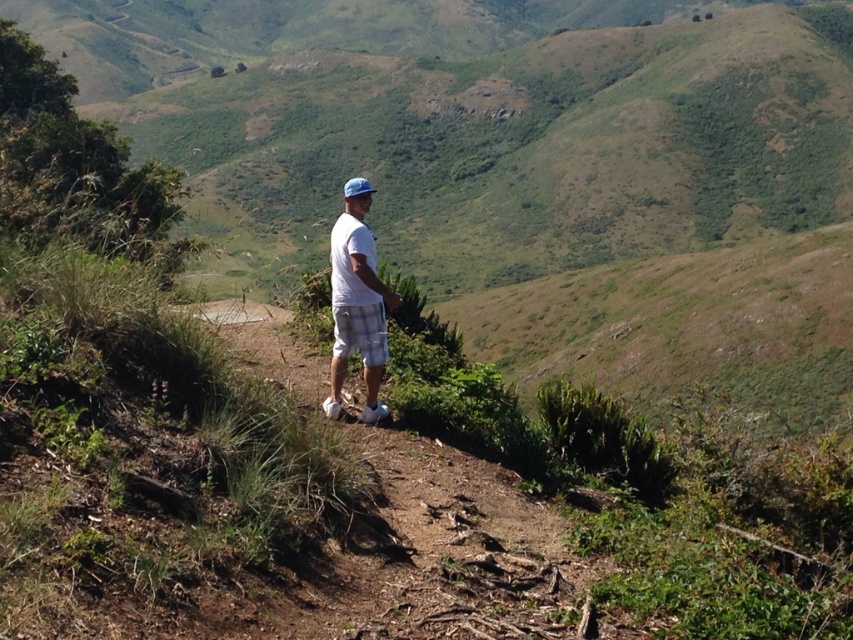
Question: Which of the following is the farthest from the observer?

Choices:
 (A) white cotton shirt at center
 (B) white checkered shorts at center

Answer: (B)

Question: Among these points, which one is farthest from the camera?

Choices:
 (A) (351, 186)
 (B) (364, 317)

Answer: (B)

Question: Is white cotton shirt at center bigger than white checkered shorts at center?

Choices:
 (A) no
 (B) yes

Answer: (B)

Question: Which point is farther to the camera?

Choices:
 (A) white cotton shirt at center
 (B) white checkered shorts at center

Answer: (B)

Question: Can you confirm if white cotton shirt at center is positioned above white checkered shorts at center?

Choices:
 (A) yes
 (B) no

Answer: (A)

Question: Can you confirm if white cotton shirt at center is positioned below white checkered shorts at center?

Choices:
 (A) no
 (B) yes

Answer: (A)